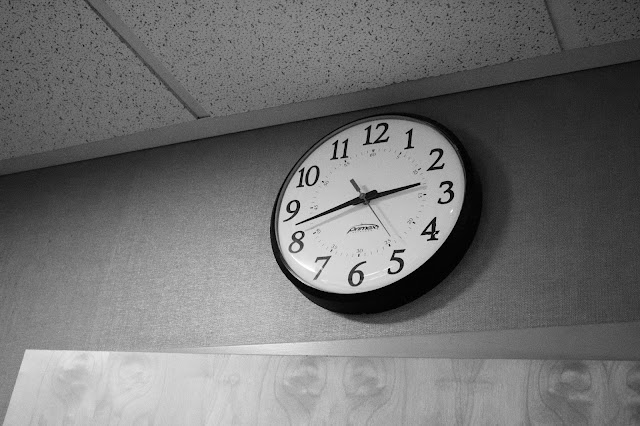
Where is `door frame top`? The image size is (640, 426). door frame top is located at coordinates (536, 344).